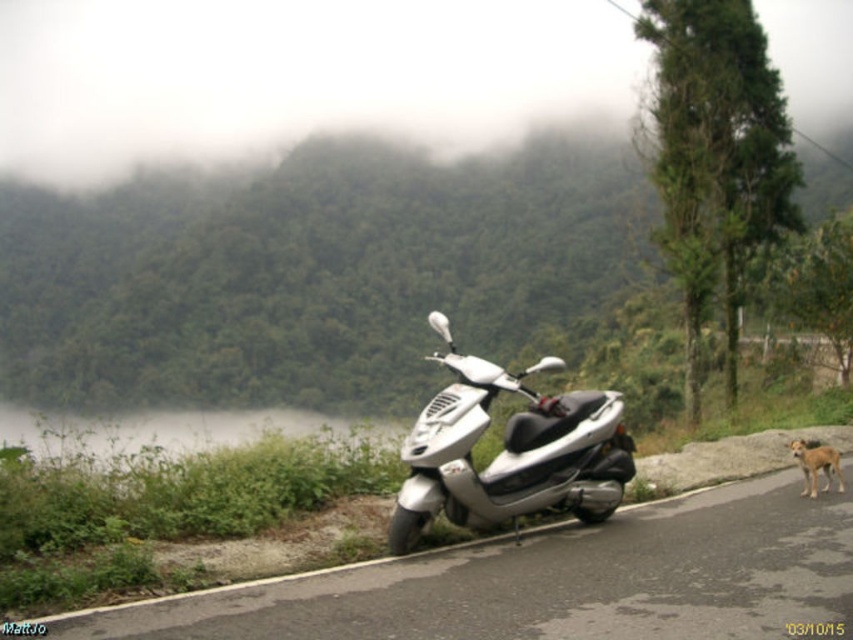
You are a delivery person who needs to move the metallic silver scooter at center to make space for a delivery van that is 3 meters long. Can you move the scooter close to the brown fur dog at lower right without blocking the van? Explain your reasoning.

The metallic silver scooter at center is 3.29 meters away from the brown fur dog at lower right. Since the delivery van is 3 meters long, moving the scooter to within 3 meters of the dog would leave enough space for the van to fit without obstruction. Therefore, moving the scooter closer to the brown fur dog at lower right would work as the distance between them allows sufficient clearance for the van.

You are standing at the point marked as point (x=403, y=502) and want to move to the point marked as point (x=827, y=451). Which direction should you walk to get closer to your destination?

You should walk backward because point (x=403, y=502) is closer to the viewer than point (x=827, y=451). Moving backward would take you away from the viewer, towards the destination.